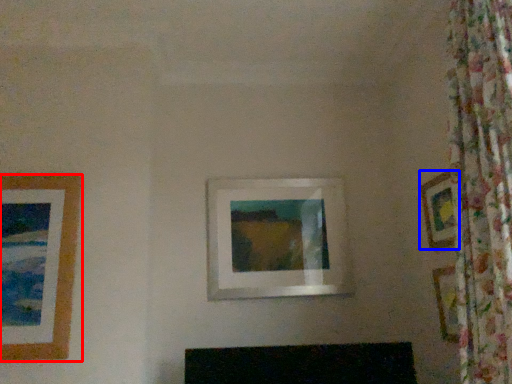
Question: Among these objects, which one is farthest to the camera, picture frame (highlighted by a red box) or picture frame (highlighted by a blue box)?

Choices:
 (A) picture frame
 (B) picture frame

Answer: (B)